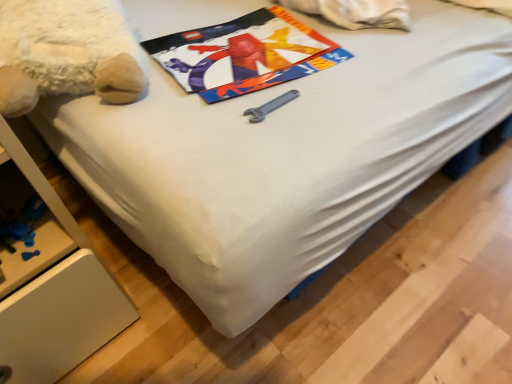
Where is `metallic poster at center`? metallic poster at center is located at coordinates (244, 54).

The width and height of the screenshot is (512, 384). What do you see at coordinates (244, 54) in the screenshot? I see `metallic poster at center` at bounding box center [244, 54].

This screenshot has width=512, height=384. Describe the element at coordinates (66, 53) in the screenshot. I see `fluffy white teddy bear at upper left` at that location.

This screenshot has width=512, height=384. In order to click on fluffy white teddy bear at upper left in this screenshot , I will do (66, 53).

Find the location of `metallic poster at center`. metallic poster at center is located at coordinates (244, 54).

Can you confirm if metallic poster at center is positioned to the right of fluffy white teddy bear at upper left?

Yes, metallic poster at center is to the right of fluffy white teddy bear at upper left.

In the image, is metallic poster at center positioned in front of or behind fluffy white teddy bear at upper left?

Clearly, metallic poster at center is behind fluffy white teddy bear at upper left.

Is point (241, 85) closer or farther from the camera than point (14, 49)?

Point (241, 85) is positioned farther from the camera compared to point (14, 49).

From the image's perspective, which is above, metallic poster at center or fluffy white teddy bear at upper left?

fluffy white teddy bear at upper left is shown above in the image.

From a real-world perspective, who is located higher, metallic poster at center or fluffy white teddy bear at upper left?

In real-world perspective, fluffy white teddy bear at upper left is above.

Which of these two, metallic poster at center or fluffy white teddy bear at upper left, is thinner?

metallic poster at center.

Who is taller, metallic poster at center or fluffy white teddy bear at upper left?

With more height is fluffy white teddy bear at upper left.

Looking at the image, does metallic poster at center seem bigger or smaller compared to fluffy white teddy bear at upper left?

metallic poster at center is smaller than fluffy white teddy bear at upper left.

Is fluffy white teddy bear at upper left located within metallic poster at center?

No, fluffy white teddy bear at upper left is located outside of metallic poster at center.

Based on the photo, would you consider metallic poster at center to be distant from fluffy white teddy bear at upper left?

No, metallic poster at center is not far from fluffy white teddy bear at upper left.

Is metallic poster at center facing away from fluffy white teddy bear at upper left?

No, fluffy white teddy bear at upper left is not at the back of metallic poster at center.

How different are the orientations of metallic poster at center and fluffy white teddy bear at upper left in degrees?

metallic poster at center and fluffy white teddy bear at upper left are facing 6.56 degrees away from each other.

Measure the distance from metallic poster at center to fluffy white teddy bear at upper left.

17.25 centimeters.

Locate an element on the screen. Image resolution: width=512 pixels, height=384 pixels. teddy bear on the left of metallic poster at center is located at coordinates (66, 53).

Is fluffy white teddy bear at upper left at the left side of metallic poster at center?

Yes.

Between fluffy white teddy bear at upper left and metallic poster at center, which one is positioned behind?

metallic poster at center is behind.

Which is less distant, (64,63) or (316,66)?

Clearly, point (64,63) is closer to the camera than point (316,66).

From the image's perspective, is fluffy white teddy bear at upper left under metallic poster at center?

No, from the image's perspective, fluffy white teddy bear at upper left is not beneath metallic poster at center.

From a real-world perspective, is fluffy white teddy bear at upper left above or below metallic poster at center?

In terms of real-world spatial position, fluffy white teddy bear at upper left is above metallic poster at center.

Looking at their sizes, would you say fluffy white teddy bear at upper left is wider or thinner than metallic poster at center?

fluffy white teddy bear at upper left is wider than metallic poster at center.

Which of these two, fluffy white teddy bear at upper left or metallic poster at center, stands taller?

fluffy white teddy bear at upper left.

Is fluffy white teddy bear at upper left smaller than metallic poster at center?

Actually, fluffy white teddy bear at upper left might be larger than metallic poster at center.

Would you say fluffy white teddy bear at upper left contains metallic poster at center?

Definitely not — metallic poster at center is not inside fluffy white teddy bear at upper left.

Is fluffy white teddy bear at upper left with metallic poster at center?

fluffy white teddy bear at upper left and metallic poster at center are clearly separated.

In the scene shown: Is fluffy white teddy bear at upper left turned away from metallic poster at center?

fluffy white teddy bear at upper left does not have its back to metallic poster at center.

How much distance is there between fluffy white teddy bear at upper left and metallic poster at center?

The distance of fluffy white teddy bear at upper left from metallic poster at center is 6.79 inches.

Identify the location of teddy bear above the metallic poster at center (from the image's perspective). This screenshot has width=512, height=384. (66, 53).

This screenshot has width=512, height=384. Identify the location of teddy bear that appears above the metallic poster at center (from a real-world perspective). (66, 53).

Locate an element on the screen. The width and height of the screenshot is (512, 384). teddy bear in front of the metallic poster at center is located at coordinates (66, 53).